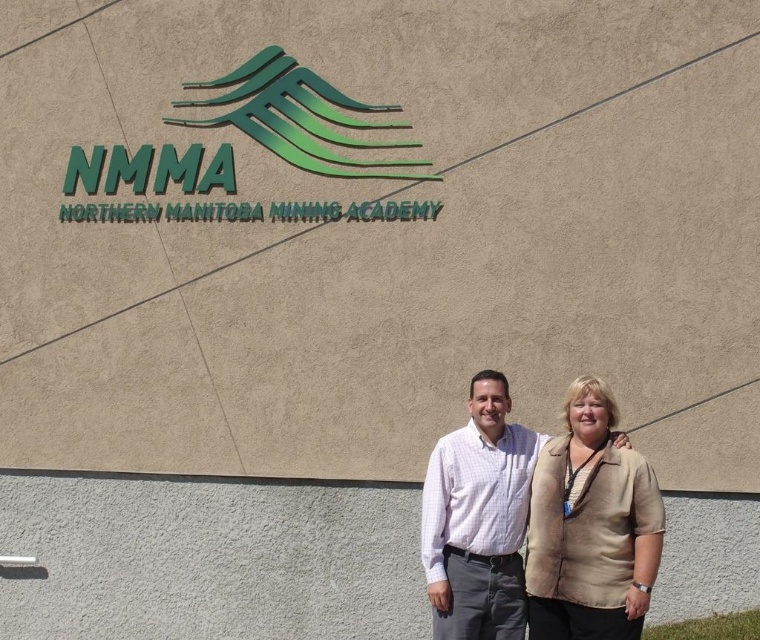
Question: Is beige fabric jacket at lower right positioned behind white checkered shirt at center?

Choices:
 (A) yes
 (B) no

Answer: (B)

Question: Which of the following is the farthest from the observer?

Choices:
 (A) beige fabric jacket at lower right
 (B) white checkered shirt at center

Answer: (B)

Question: Is beige fabric jacket at lower right to the right of white checkered shirt at center from the viewer's perspective?

Choices:
 (A) yes
 (B) no

Answer: (A)

Question: Which point is closer to the camera taking this photo?

Choices:
 (A) (553, 484)
 (B) (483, 484)

Answer: (A)

Question: Can you confirm if beige fabric jacket at lower right is smaller than white checkered shirt at center?

Choices:
 (A) no
 (B) yes

Answer: (A)